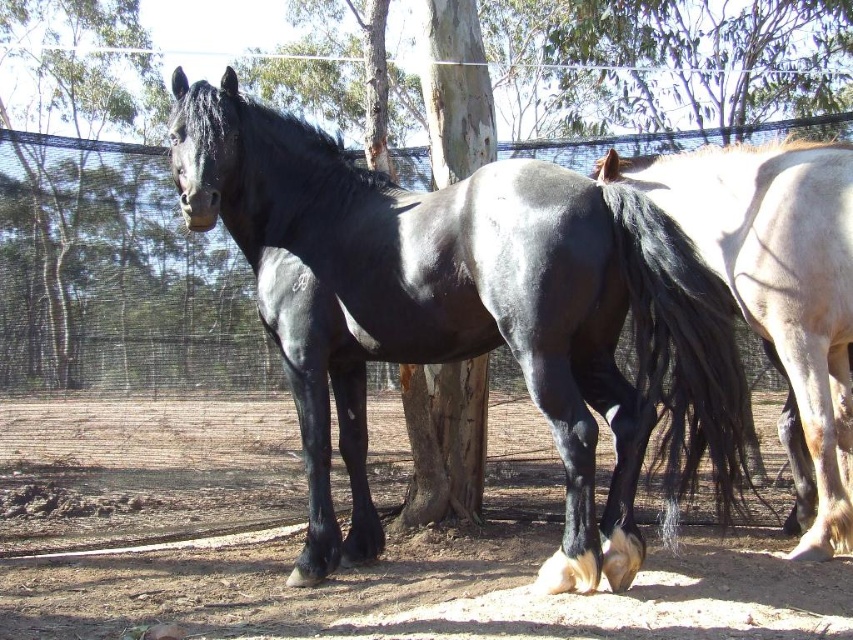
You are standing at the point labeled point (24, 156) and want to walk to the point labeled point (714, 177). Which direction should you face to move towards your destination?

To move from point (24, 156) to point (714, 177), you should face upwards because point (714, 177) is above point (24, 156).